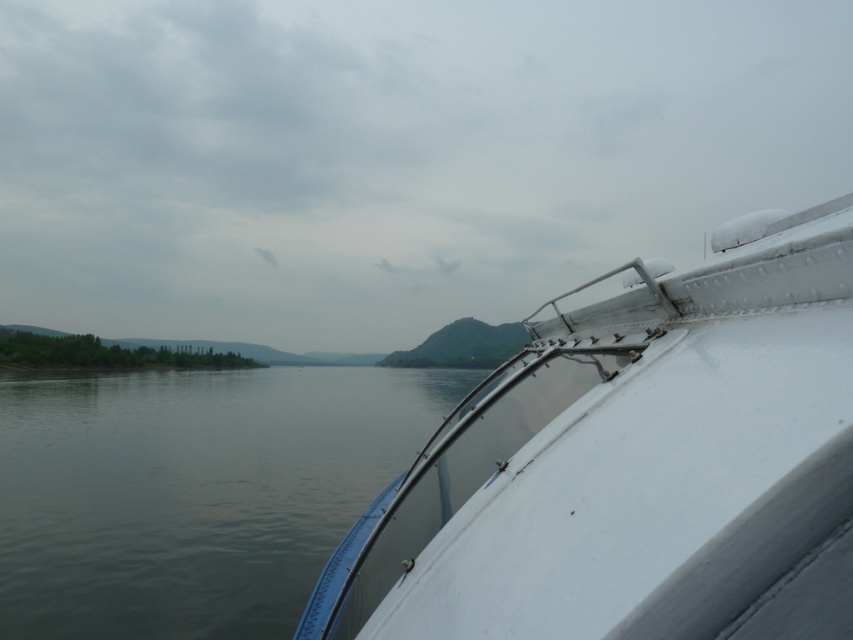
Question: Observing the image, what is the correct spatial positioning of matte white sky at upper center in reference to white matte boat at right?

Choices:
 (A) above
 (B) below

Answer: (A)

Question: Which of the following is the closest to the observer?

Choices:
 (A) (688, 342)
 (B) (368, 148)

Answer: (A)

Question: Does matte white sky at upper center come in front of white matte boat at right?

Choices:
 (A) no
 (B) yes

Answer: (A)

Question: Among these points, which one is farthest from the camera?

Choices:
 (A) pos(224,248)
 (B) pos(527,556)

Answer: (A)

Question: Which point is farther to the camera?

Choices:
 (A) (245, 477)
 (B) (274, 262)
 (C) (776, 362)

Answer: (B)

Question: Can you confirm if matte white sky at upper center is smaller than gray water at center?

Choices:
 (A) yes
 (B) no

Answer: (B)